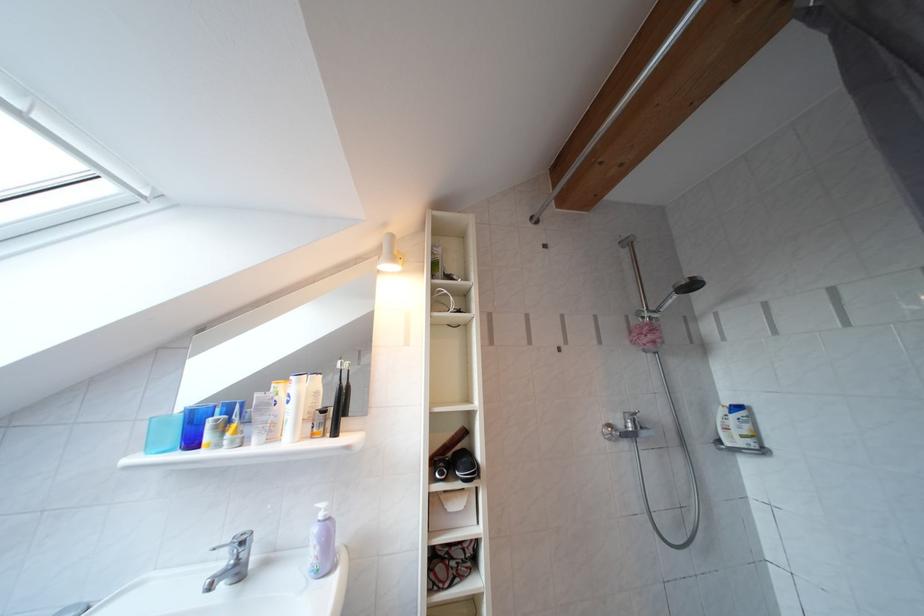
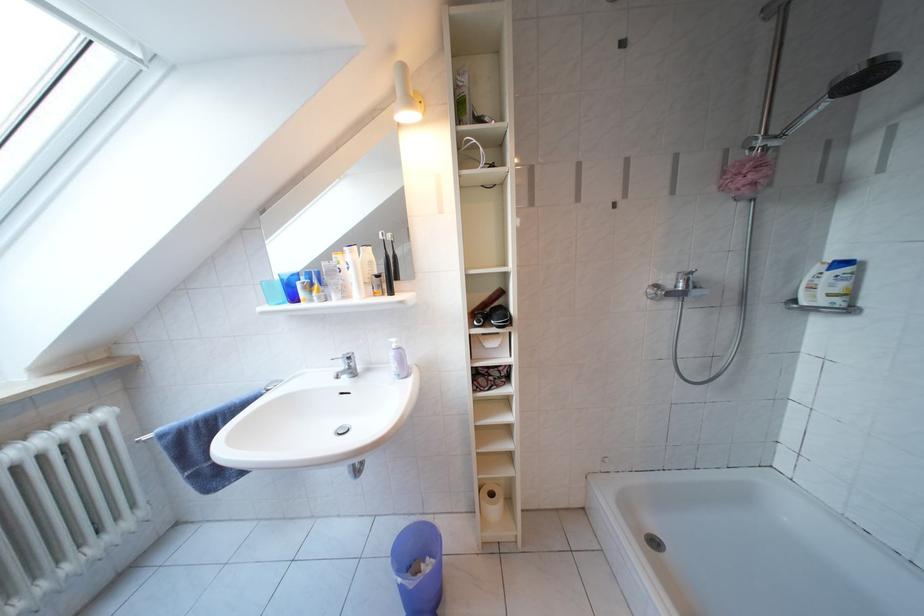
Locate, in the second image, the point that corresponds to point 331,511 in the first image.

(402, 345)